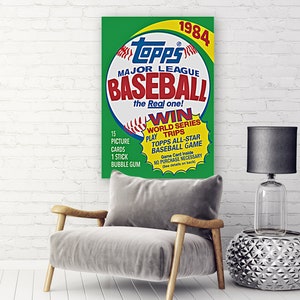
Locate an element on the screen. The height and width of the screenshot is (300, 300). floor is located at coordinates (24, 277).